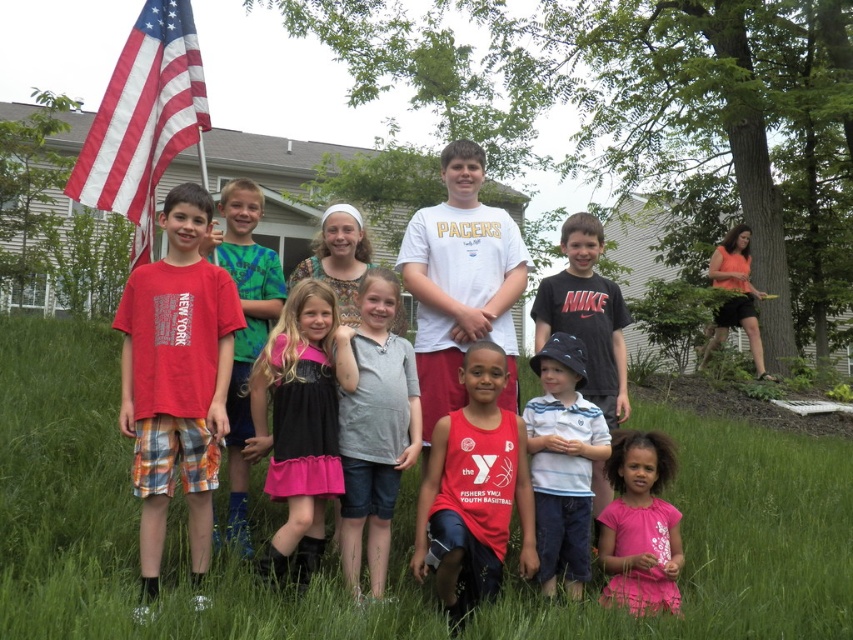
Measure the distance from gray cotton shirt at center to matte red shirt at center.

gray cotton shirt at center and matte red shirt at center are 8.37 feet apart from each other.

Is gray cotton shirt at center smaller than matte red shirt at center?

Actually, gray cotton shirt at center might be larger than matte red shirt at center.

Which is in front, point (344, 508) or point (242, 417)?

Positioned in front is point (344, 508).

The image size is (853, 640). I want to click on gray cotton shirt at center, so click(373, 426).

Which of these two, green grass at center or pink satin dress at center, stands taller?

Standing taller between the two is pink satin dress at center.

Is green grass at center positioned at the back of pink satin dress at center?

That is False.

I want to click on green grass at center, so 135,518.

Locate an element on the screen. The image size is (853, 640). green grass at center is located at coordinates click(135, 518).

Which is more to the left, blue striped shirt at center or pink fabric dress at lower right?

blue striped shirt at center

Can you confirm if blue striped shirt at center is smaller than pink fabric dress at lower right?

Actually, blue striped shirt at center might be larger than pink fabric dress at lower right.

Does point (587, 417) come in front of point (664, 516)?

No, (587, 417) is behind (664, 516).

Identify the location of blue striped shirt at center. (561, 464).